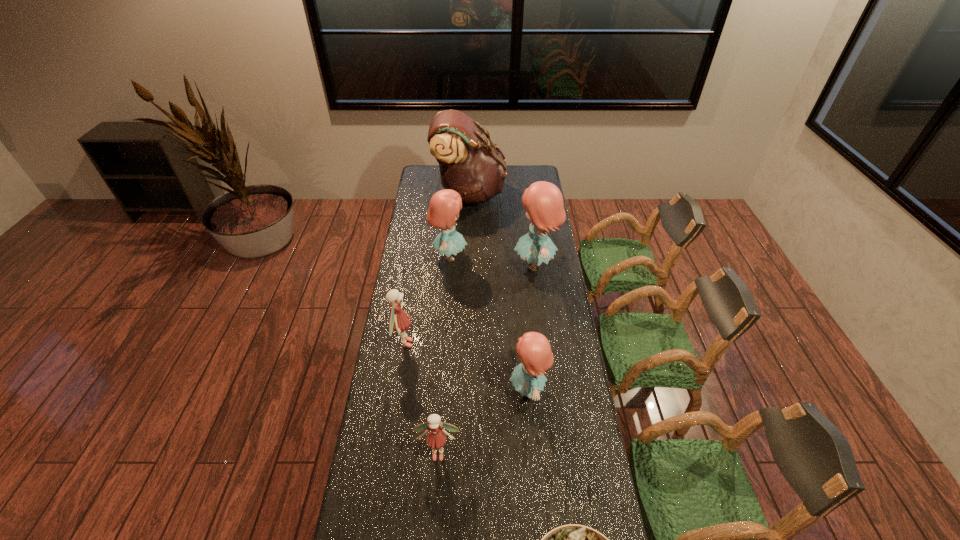
I want to click on satchel that is positioned at the left edge, so click(469, 164).

This screenshot has width=960, height=540. In order to click on object that is at the far left corner in this screenshot , I will do `click(469, 164)`.

In the image, there is a desktop. Where is `vacant space at the left edge`? The width and height of the screenshot is (960, 540). vacant space at the left edge is located at coordinates (416, 241).

The image size is (960, 540). What are the coordinates of `vacant space at the right edge of the desktop` in the screenshot? It's located at (564, 461).

In order to click on vacant area that lies between the bigger pink doll and the smallest blue doll in this screenshot , I will do `click(467, 366)`.

Locate an element on the screen. Image resolution: width=960 pixels, height=540 pixels. free point between the third tallest object and the smallest blue doll is located at coordinates (489, 323).

Find the location of a particular element. This screenshot has height=540, width=960. vacant area between the farther pink doll and the biggest blue doll is located at coordinates (469, 304).

Identify the location of free space between the nearest doll and the satchel. This screenshot has height=540, width=960. (454, 323).

Find the location of a particular element. free space between the right pink doll and the second biggest blue doll is located at coordinates (444, 355).

You are a GUI agent. You are given a task and a screenshot of the screen. Output one action in this format:
    pyautogui.click(x=<x>, y=<y>)
    Task: Click on the object identified as the closest to the farther pink doll
    
    Given the screenshot: What is the action you would take?
    pyautogui.click(x=444, y=207)